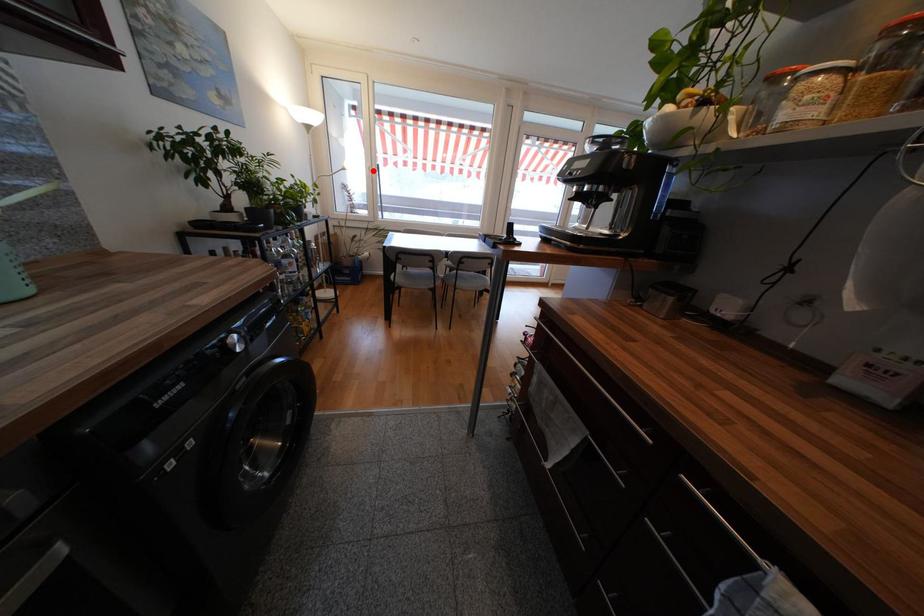
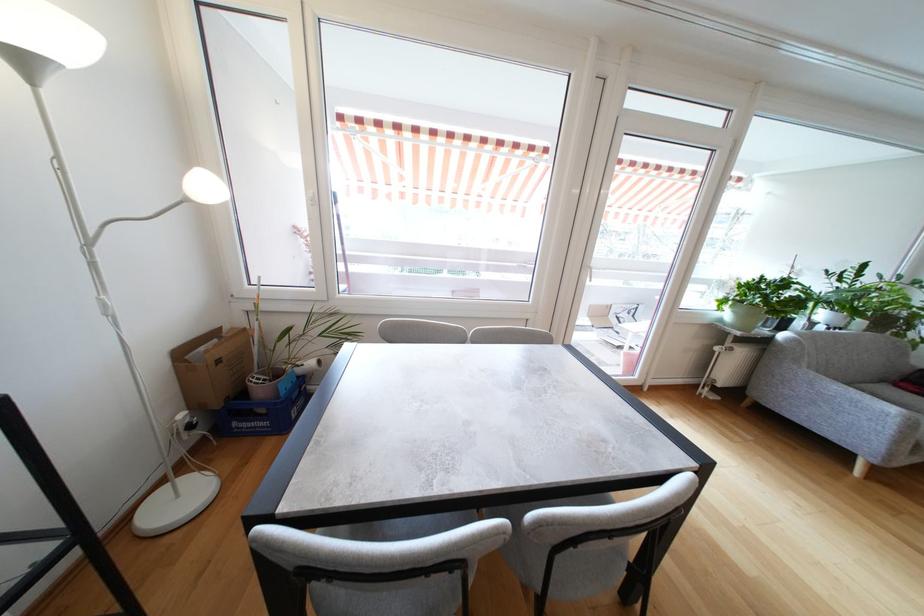
Question: I am providing you with two images of the same scene from different viewpoints. Given a red point in image1, look at the same physical point in image2. Is it:

Choices:
 (A) Closer to the viewpoint
 (B) Farther from the viewpoint

Answer: (B)